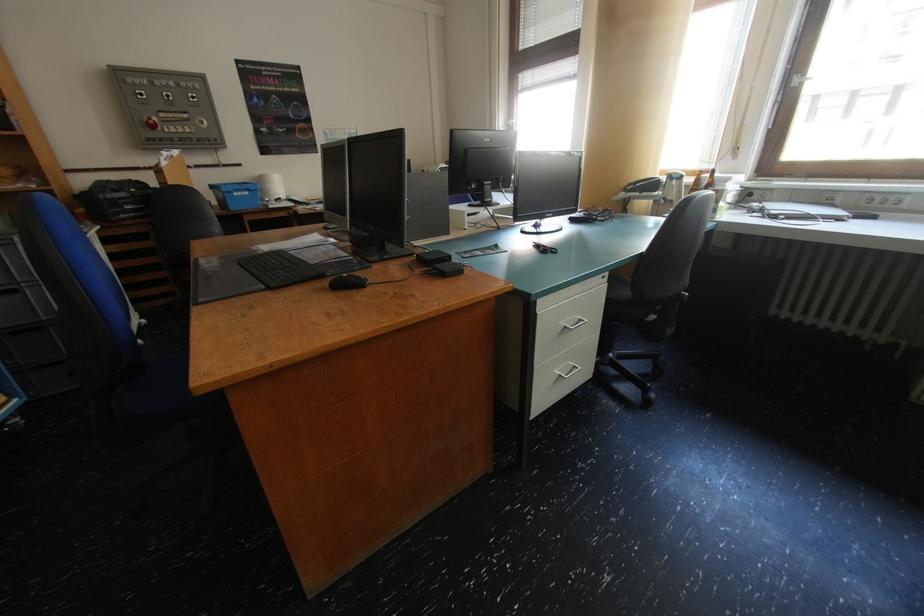
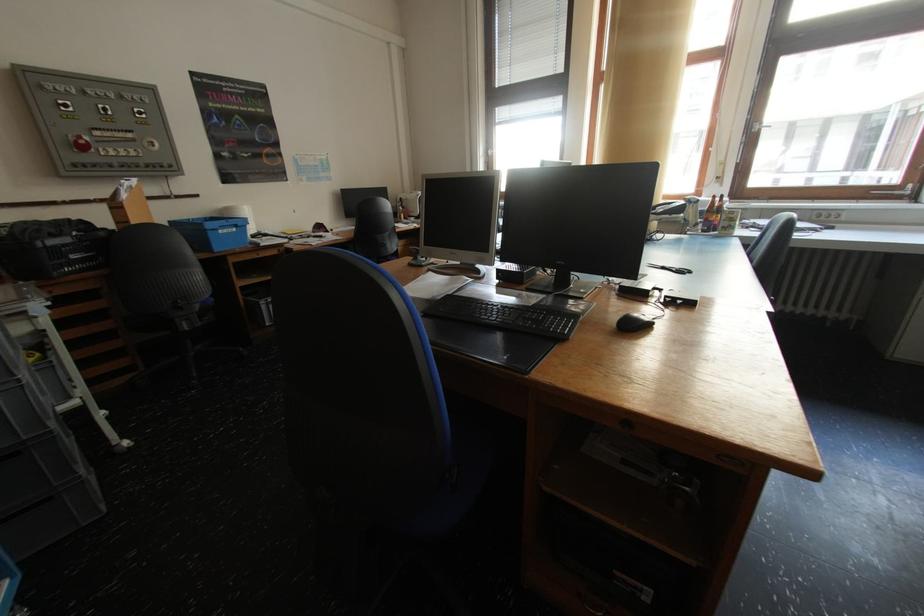
In the second image, find the point that corresponds to (x=244, y=196) in the first image.

(228, 233)